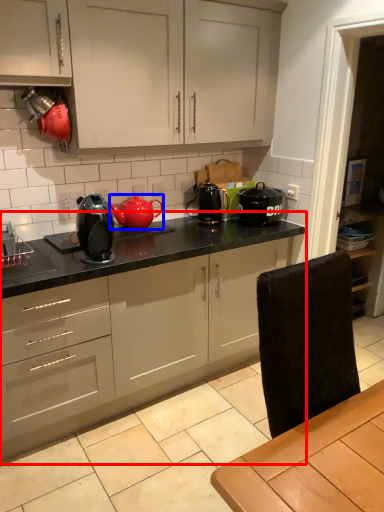
Question: Which object is further to the camera taking this photo, countertop (highlighted by a red box) or kitchen appliance (highlighted by a blue box)?

Choices:
 (A) countertop
 (B) kitchen appliance

Answer: (B)